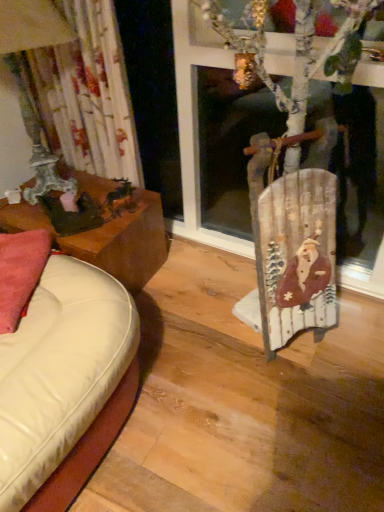
Question: From the image's perspective, relative to wooden sled at right, is floral fabric curtain at left above or below?

Choices:
 (A) above
 (B) below

Answer: (A)

Question: Is floral fabric curtain at left situated inside wooden sled at right or outside?

Choices:
 (A) inside
 (B) outside

Answer: (B)

Question: Estimate the real-world distances between objects in this image. Which object is closer to the brown wooden table at left?

Choices:
 (A) pink fabric pillow at left
 (B) floral fabric curtain at left
 (C) wooden sled at right

Answer: (B)

Question: Which of these objects is positioned farthest from the pink fabric pillow at left?

Choices:
 (A) floral fabric curtain at left
 (B) wooden sled at right
 (C) brown wooden table at left

Answer: (B)